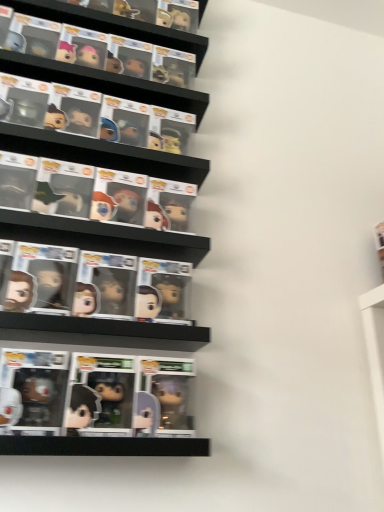
What is the approximate height of translucent plastic figure at center, which ranks as the second comic book in right-to-left order?

translucent plastic figure at center, which ranks as the second comic book in right-to-left order, is 5.52 inches in height.

This screenshot has height=512, width=384. I want to click on translucent plastic figure at center, which ranks as the first comic book in left-to-right order, so click(x=105, y=285).

Measure the distance between point (97, 298) and camera.

Point (97, 298) and camera are 33.94 inches apart.

Describe the element at coordinates (105, 285) in the screenshot. This screenshot has height=512, width=384. I see `translucent plastic figure at center, which ranks as the second comic book in right-to-left order` at that location.

Locate an element on the screen. The width and height of the screenshot is (384, 512). shiny plastic figure at center, the 2th comic book in the left-to-right sequence is located at coordinates (163, 290).

What do you see at coordinates (163, 290) in the screenshot? This screenshot has height=512, width=384. I see `shiny plastic figure at center, arranged as the first comic book when viewed from the right` at bounding box center [163, 290].

In order to face shiny plastic figure at center, arranged as the first comic book when viewed from the right, should I rotate leftwards or rightwards?

Turn left approximately 4.470 degrees to face it.

Where is `translucent plastic figure at center, which ranks as the first comic book in left-to-right order`? translucent plastic figure at center, which ranks as the first comic book in left-to-right order is located at coordinates (105, 285).

Is translucent plastic figure at center, which ranks as the first comic book in left-to-right order, at the right side of shiny plastic figure at center, arranged as the first comic book when viewed from the right?

In fact, translucent plastic figure at center, which ranks as the first comic book in left-to-right order, is to the left of shiny plastic figure at center, arranged as the first comic book when viewed from the right.

Is translucent plastic figure at center, which ranks as the second comic book in right-to-left order, positioned in front of shiny plastic figure at center, arranged as the first comic book when viewed from the right?

Yes, translucent plastic figure at center, which ranks as the second comic book in right-to-left order, is closer to the camera.

Is point (128, 300) in front of point (160, 265)?

Yes, it is in front of point (160, 265).

From the image's perspective, which one is positioned higher, translucent plastic figure at center, which ranks as the first comic book in left-to-right order, or shiny plastic figure at center, the 2th comic book in the left-to-right sequence?

translucent plastic figure at center, which ranks as the first comic book in left-to-right order, is shown above in the image.

From a real-world perspective, is translucent plastic figure at center, which ranks as the second comic book in right-to-left order, beneath shiny plastic figure at center, arranged as the first comic book when viewed from the right?

No, from a real-world perspective, translucent plastic figure at center, which ranks as the second comic book in right-to-left order, is not beneath shiny plastic figure at center, arranged as the first comic book when viewed from the right.

Can you confirm if translucent plastic figure at center, which ranks as the first comic book in left-to-right order, is wider than shiny plastic figure at center, arranged as the first comic book when viewed from the right?

Incorrect, the width of translucent plastic figure at center, which ranks as the first comic book in left-to-right order, does not surpass that of shiny plastic figure at center, arranged as the first comic book when viewed from the right.

Is translucent plastic figure at center, which ranks as the second comic book in right-to-left order, taller or shorter than shiny plastic figure at center, the 2th comic book in the left-to-right sequence?

In the image, translucent plastic figure at center, which ranks as the second comic book in right-to-left order, appears to be shorter than shiny plastic figure at center, the 2th comic book in the left-to-right sequence.

Between translucent plastic figure at center, which ranks as the first comic book in left-to-right order, and shiny plastic figure at center, arranged as the first comic book when viewed from the right, which one has smaller size?

With smaller size is translucent plastic figure at center, which ranks as the first comic book in left-to-right order.

Is translucent plastic figure at center, which ranks as the first comic book in left-to-right order, not within shiny plastic figure at center, arranged as the first comic book when viewed from the right?

Yes.

Is translucent plastic figure at center, which ranks as the second comic book in right-to-left order, next to shiny plastic figure at center, arranged as the first comic book when viewed from the right?

Yes, translucent plastic figure at center, which ranks as the second comic book in right-to-left order, is touching shiny plastic figure at center, arranged as the first comic book when viewed from the right.

Is translucent plastic figure at center, which ranks as the second comic book in right-to-left order, facing towards shiny plastic figure at center, arranged as the first comic book when viewed from the right?

No, translucent plastic figure at center, which ranks as the second comic book in right-to-left order, is not aimed at shiny plastic figure at center, arranged as the first comic book when viewed from the right.

How far apart are translucent plastic figure at center, which ranks as the first comic book in left-to-right order, and shiny plastic figure at center, arranged as the first comic book when viewed from the right?

They are 2.74 inches apart.

Identify the location of comic book on the right of translucent plastic figure at center, which ranks as the second comic book in right-to-left order. (163, 290).

Considering the positions of objects shiny plastic figure at center, the 2th comic book in the left-to-right sequence, and translucent plastic figure at center, which ranks as the second comic book in right-to-left order, in the image provided, who is more to the right, shiny plastic figure at center, the 2th comic book in the left-to-right sequence, or translucent plastic figure at center, which ranks as the second comic book in right-to-left order,?

shiny plastic figure at center, the 2th comic book in the left-to-right sequence.

Relative to translucent plastic figure at center, which ranks as the first comic book in left-to-right order, is shiny plastic figure at center, arranged as the first comic book when viewed from the right, in front or behind?

In the image, shiny plastic figure at center, arranged as the first comic book when viewed from the right, appears behind translucent plastic figure at center, which ranks as the first comic book in left-to-right order.

Is point (168, 270) positioned before point (116, 300)?

That is False.

From the image's perspective, which object appears higher, shiny plastic figure at center, arranged as the first comic book when viewed from the right, or translucent plastic figure at center, which ranks as the second comic book in right-to-left order?

From the image's view, translucent plastic figure at center, which ranks as the second comic book in right-to-left order, is above.

From a real-world perspective, is shiny plastic figure at center, arranged as the first comic book when viewed from the right, physically below translucent plastic figure at center, which ranks as the second comic book in right-to-left order?

Indeed, from a real-world perspective, shiny plastic figure at center, arranged as the first comic book when viewed from the right, is positioned beneath translucent plastic figure at center, which ranks as the second comic book in right-to-left order.

Is shiny plastic figure at center, arranged as the first comic book when viewed from the right, wider or thinner than translucent plastic figure at center, which ranks as the second comic book in right-to-left order?

In the image, shiny plastic figure at center, arranged as the first comic book when viewed from the right, appears to be wider than translucent plastic figure at center, which ranks as the second comic book in right-to-left order.

From their relative heights in the image, would you say shiny plastic figure at center, arranged as the first comic book when viewed from the right, is taller or shorter than translucent plastic figure at center, which ranks as the second comic book in right-to-left order?

Considering their sizes, shiny plastic figure at center, arranged as the first comic book when viewed from the right, has less height than translucent plastic figure at center, which ranks as the second comic book in right-to-left order.

Looking at the image, does shiny plastic figure at center, the 2th comic book in the left-to-right sequence, seem bigger or smaller compared to translucent plastic figure at center, which ranks as the first comic book in left-to-right order?

In the image, shiny plastic figure at center, the 2th comic book in the left-to-right sequence, appears to be larger than translucent plastic figure at center, which ranks as the first comic book in left-to-right order.

Is shiny plastic figure at center, arranged as the first comic book when viewed from the right, spatially inside translucent plastic figure at center, which ranks as the first comic book in left-to-right order, or outside of it?

shiny plastic figure at center, arranged as the first comic book when viewed from the right, is not enclosed by translucent plastic figure at center, which ranks as the first comic book in left-to-right order.

Is shiny plastic figure at center, arranged as the first comic book when viewed from the right, directly adjacent to translucent plastic figure at center, which ranks as the second comic book in right-to-left order?

Yes.

Is shiny plastic figure at center, arranged as the first comic book when viewed from the right, facing away from translucent plastic figure at center, which ranks as the first comic book in left-to-right order?

No, shiny plastic figure at center, arranged as the first comic book when viewed from the right,'s orientation is not away from translucent plastic figure at center, which ranks as the first comic book in left-to-right order.

How many degrees apart are the facing directions of shiny plastic figure at center, arranged as the first comic book when viewed from the right, and translucent plastic figure at center, which ranks as the second comic book in right-to-left order?

The facing directions of shiny plastic figure at center, arranged as the first comic book when viewed from the right, and translucent plastic figure at center, which ranks as the second comic book in right-to-left order, are 5.46e-05 degrees apart.

You are a GUI agent. You are given a task and a screenshot of the screen. Output one action in this format:
    pyautogui.click(x=<x>, y=<y>)
    Task: Click on the comic book above the shiny plastic figure at center, arranged as the first comic book when viewed from the right (from the image's perspective)
    
    Given the screenshot: What is the action you would take?
    pyautogui.click(x=105, y=285)

You are a GUI agent. You are given a task and a screenshot of the screen. Output one action in this format:
    pyautogui.click(x=<x>, y=<y>)
    Task: Click on the comic book that appears behind the translucent plastic figure at center, which ranks as the second comic book in right-to-left order
    The width and height of the screenshot is (384, 512).
    Given the screenshot: What is the action you would take?
    pyautogui.click(x=163, y=290)

There is a shiny plastic figure at center, arranged as the first comic book when viewed from the right. At what (x,y) coordinates should I click in order to perform the action: click on comic book above it (from a real-world perspective). Please return your answer as a coordinate pair (x, y). Looking at the image, I should click on (105, 285).